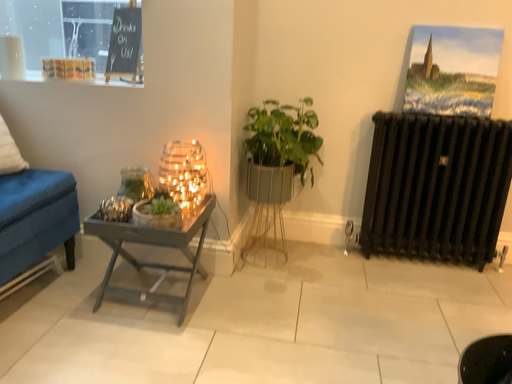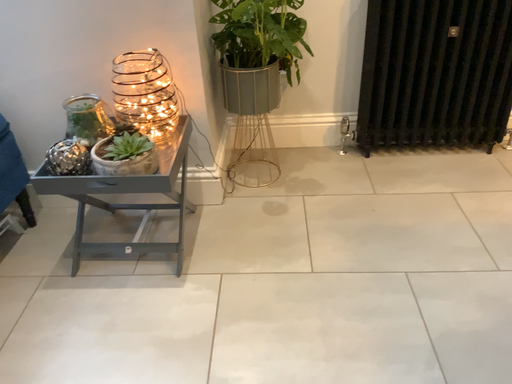
Question: How did the camera likely rotate when shooting the video?

Choices:
 (A) rotated upward
 (B) rotated downward

Answer: (B)